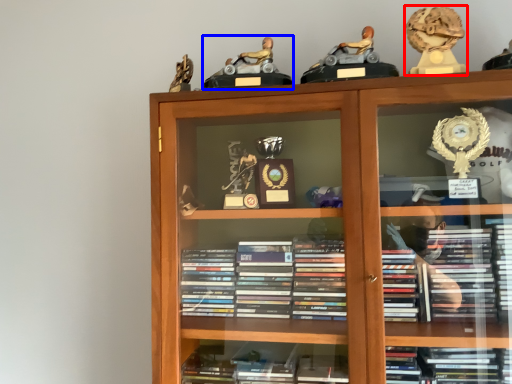
Question: Which point is closer to the camera, toy (highlighted by a red box) or toy (highlighted by a blue box)?

Choices:
 (A) toy
 (B) toy

Answer: (A)